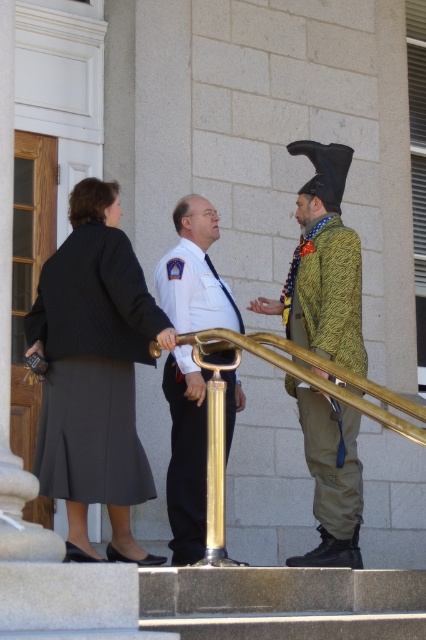
Question: Does dark gray wool skirt at center appear under white uniform at center?

Choices:
 (A) no
 (B) yes

Answer: (A)

Question: Which object appears farthest from the camera in this image?

Choices:
 (A) white uniform at center
 (B) dark gray wool skirt at center

Answer: (A)

Question: Can you confirm if dark gray wool skirt at center is positioned below white uniform at center?

Choices:
 (A) no
 (B) yes

Answer: (A)

Question: Which point is closer to the camera taking this photo?

Choices:
 (A) (345, 410)
 (B) (198, 259)
 (C) (51, 428)

Answer: (C)

Question: Observing the image, what is the correct spatial positioning of white uniform at center in reference to green textured jacket at right?

Choices:
 (A) left
 (B) right

Answer: (A)

Question: Which of the following is the farthest from the observer?

Choices:
 (A) green textured jacket at right
 (B) white uniform at center

Answer: (A)